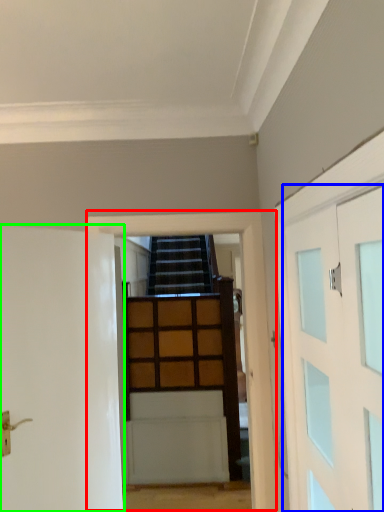
Question: Based on their relative distances, which object is nearer to garage door (highlighted by a red box)? Choose from door (highlighted by a blue box) and door (highlighted by a green box).

Choices:
 (A) door
 (B) door

Answer: (B)